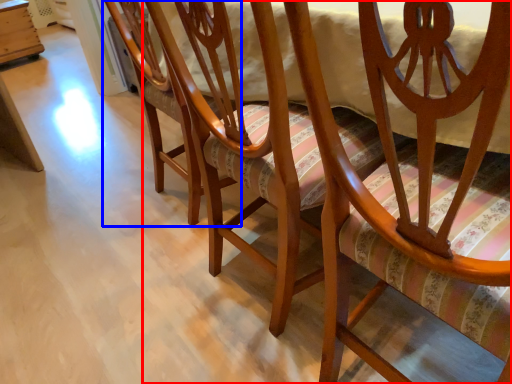
Question: Which point is further to the camera, chair (highlighted by a red box) or chair (highlighted by a blue box)?

Choices:
 (A) chair
 (B) chair

Answer: (B)